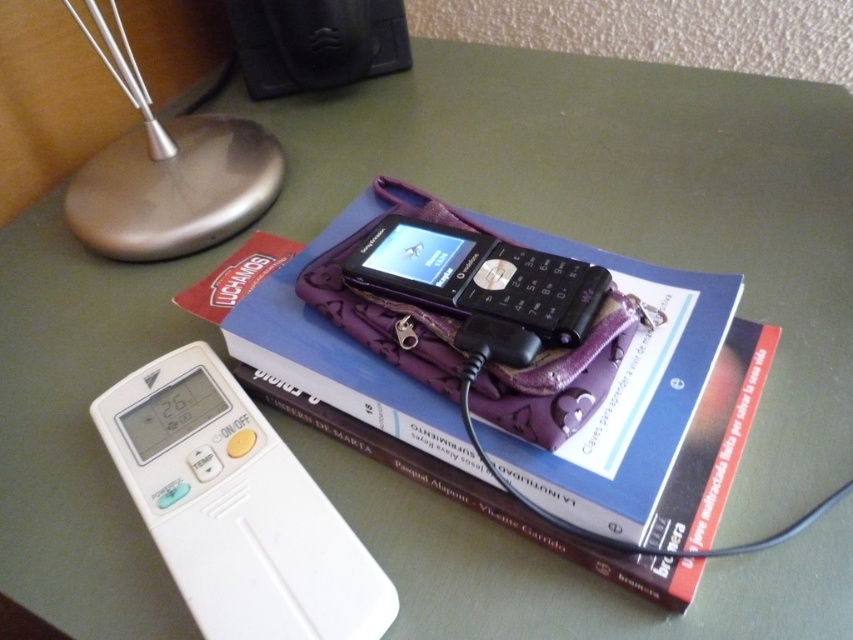
Question: Is satin silver base at upper left to the right of black plastic phone at center from the viewer's perspective?

Choices:
 (A) yes
 (B) no

Answer: (B)

Question: Can you confirm if blue hardcover book at center is positioned to the right of satin silver base at upper left?

Choices:
 (A) no
 (B) yes

Answer: (B)

Question: Which point is closer to the camera?

Choices:
 (A) (252, 449)
 (B) (178, 136)
 (C) (763, 364)
 (D) (431, 298)

Answer: (A)

Question: Among these points, which one is farthest from the camera?

Choices:
 (A) (134, 140)
 (B) (281, 372)
 (C) (590, 300)

Answer: (A)

Question: Is blue hardcover book at center positioned behind white plastic ipod at lower left?

Choices:
 (A) yes
 (B) no

Answer: (A)

Question: Which of the following is the farthest from the observer?

Choices:
 (A) satin silver base at upper left
 (B) white plastic ipod at lower left

Answer: (A)